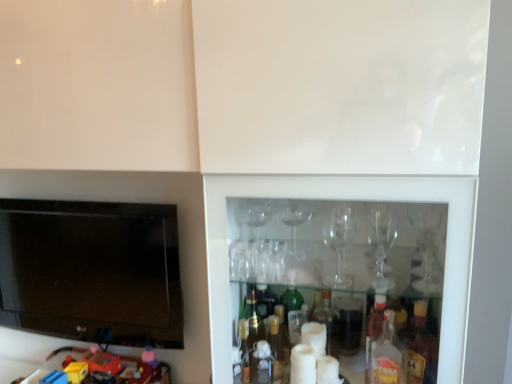
Question: Is black glossy flat-screen tv at left at the right side of plastic toy car at lower left?

Choices:
 (A) no
 (B) yes

Answer: (A)

Question: Is black glossy flat-screen tv at left thinner than plastic toy car at lower left?

Choices:
 (A) no
 (B) yes

Answer: (B)

Question: From the image's perspective, is black glossy flat-screen tv at left located beneath plastic toy car at lower left?

Choices:
 (A) no
 (B) yes

Answer: (A)

Question: Is black glossy flat-screen tv at left positioned with its back to plastic toy car at lower left?

Choices:
 (A) no
 (B) yes

Answer: (A)

Question: Could you tell me if black glossy flat-screen tv at left is facing plastic toy car at lower left?

Choices:
 (A) yes
 (B) no

Answer: (B)

Question: Is black glossy flat-screen tv at left not inside plastic toy car at lower left?

Choices:
 (A) yes
 (B) no

Answer: (A)

Question: From a real-world perspective, is plastic toy car at lower left located higher than black glossy flat-screen tv at left?

Choices:
 (A) no
 (B) yes

Answer: (A)

Question: Can you confirm if plastic toy car at lower left is positioned to the left of black glossy flat-screen tv at left?

Choices:
 (A) no
 (B) yes

Answer: (A)

Question: Is plastic toy car at lower left closer to the viewer compared to black glossy flat-screen tv at left?

Choices:
 (A) no
 (B) yes

Answer: (B)

Question: Does plastic toy car at lower left have a larger size compared to black glossy flat-screen tv at left?

Choices:
 (A) yes
 (B) no

Answer: (B)

Question: Can you confirm if plastic toy car at lower left is taller than black glossy flat-screen tv at left?

Choices:
 (A) no
 (B) yes

Answer: (A)

Question: Does plastic toy car at lower left contain black glossy flat-screen tv at left?

Choices:
 (A) no
 (B) yes

Answer: (A)

Question: Based on their sizes in the image, would you say plastic toy car at lower left is bigger or smaller than black glossy flat-screen tv at left?

Choices:
 (A) big
 (B) small

Answer: (B)